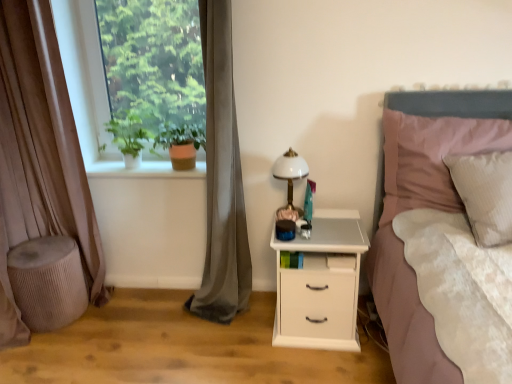
Question: Is the surface of textured beige stool at lower left in direct contact with green matte plant at upper left, positioned as the 1th plant in left-to-right order?

Choices:
 (A) yes
 (B) no

Answer: (B)

Question: Is textured beige stool at lower left further to camera compared to green matte plant at upper left, positioned as the 2th plant in right-to-left order?

Choices:
 (A) yes
 (B) no

Answer: (B)

Question: From a real-world perspective, is textured beige stool at lower left positioned over green matte plant at upper left, positioned as the 2th plant in right-to-left order, based on gravity?

Choices:
 (A) no
 (B) yes

Answer: (A)

Question: Is textured beige stool at lower left facing towards green matte plant at upper left, positioned as the 2th plant in right-to-left order?

Choices:
 (A) yes
 (B) no

Answer: (B)

Question: From a real-world perspective, is textured beige stool at lower left below green matte plant at upper left, positioned as the 1th plant in left-to-right order?

Choices:
 (A) yes
 (B) no

Answer: (A)

Question: Which is correct: brown velvet curtain at left, the 2th curtain when ordered from right to left, is inside smooth white surface at center left, or outside of it?

Choices:
 (A) inside
 (B) outside

Answer: (B)

Question: Considering the positions of brown velvet curtain at left, the 2th curtain when ordered from right to left, and smooth white surface at center left in the image, is brown velvet curtain at left, the 2th curtain when ordered from right to left, bigger or smaller than smooth white surface at center left?

Choices:
 (A) small
 (B) big

Answer: (B)

Question: From the image's perspective, is brown velvet curtain at left, the 2th curtain when ordered from right to left, located above or below smooth white surface at center left?

Choices:
 (A) below
 (B) above

Answer: (A)

Question: From a real-world perspective, is brown velvet curtain at left, the 2th curtain when ordered from right to left, positioned above or below smooth white surface at center left?

Choices:
 (A) below
 (B) above

Answer: (B)

Question: Is gray velvet curtain at left, the first curtain in the right-to-left sequence, bigger or smaller than green leafy plant at left?

Choices:
 (A) small
 (B) big

Answer: (B)

Question: Would you say gray velvet curtain at left, the first curtain in the right-to-left sequence, is inside or outside green leafy plant at left?

Choices:
 (A) outside
 (B) inside

Answer: (A)

Question: Is gray velvet curtain at left, positioned as the second curtain in left-to-right order, taller or shorter than green leafy plant at left?

Choices:
 (A) tall
 (B) short

Answer: (A)

Question: Is gray velvet curtain at left, the first curtain in the right-to-left sequence, in front of or behind green leafy plant at left in the image?

Choices:
 (A) front
 (B) behind

Answer: (A)

Question: Does point (288, 163) appear closer or farther from the camera than point (14, 261)?

Choices:
 (A) closer
 (B) farther

Answer: (A)

Question: Looking at their shapes, would you say white glossy bedside lamp at center-right is wider or thinner than textured beige stool at lower left?

Choices:
 (A) thin
 (B) wide

Answer: (A)